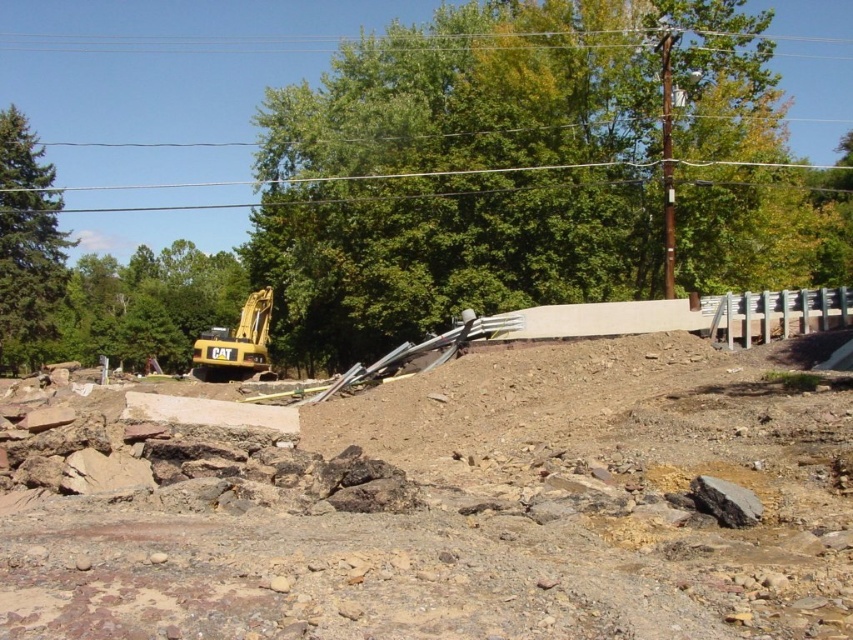
Question: Which of these objects is positioned closest to the brushed metal power line at upper center?

Choices:
 (A) brown gravel dirt at center
 (B) yellow metallic excavator at left

Answer: (B)

Question: Is brushed metal power line at upper center bigger than yellow metallic excavator at left?

Choices:
 (A) yes
 (B) no

Answer: (A)

Question: Does brown gravel dirt at center lie behind yellow metallic excavator at left?

Choices:
 (A) yes
 (B) no

Answer: (B)

Question: Considering the relative positions of brown gravel dirt at center and brushed metal power line at upper center in the image provided, where is brown gravel dirt at center located with respect to brushed metal power line at upper center?

Choices:
 (A) left
 (B) right

Answer: (B)

Question: Which object appears farthest from the camera in this image?

Choices:
 (A) brushed metal power line at upper center
 (B) brown gravel dirt at center

Answer: (A)

Question: Which of the following is the farthest from the observer?

Choices:
 (A) brushed metal power line at upper center
 (B) brown gravel dirt at center

Answer: (A)